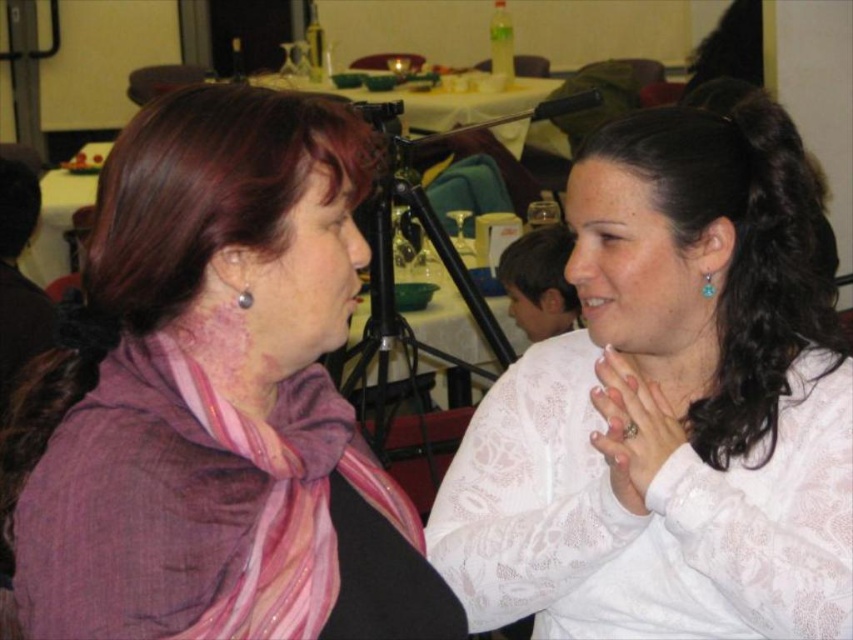
Does white lace blouse at center have a larger size compared to teal earrings at right?

Correct, white lace blouse at center is larger in size than teal earrings at right.

Which is above, white lace blouse at center or teal earrings at right?

teal earrings at right is above.

Image resolution: width=853 pixels, height=640 pixels. What do you see at coordinates (668, 406) in the screenshot? I see `white lace blouse at center` at bounding box center [668, 406].

The image size is (853, 640). What are the coordinates of `white lace blouse at center` in the screenshot? It's located at (668, 406).

Which is more to the left, purple scarf at left or teal earrings at right?

From the viewer's perspective, purple scarf at left appears more on the left side.

Is point (335, 170) more distant than point (637, 260)?

No, it is not.

Who is more forward, (67,534) or (639,310)?

Point (67,534)

Locate an element on the screen. The width and height of the screenshot is (853, 640). purple scarf at left is located at coordinates (213, 400).

Does teal earrings at right appear over silver metallic earring at upper left?

Yes.

Does point (677, 340) come behind point (242, 300)?

That is True.

You are a GUI agent. You are given a task and a screenshot of the screen. Output one action in this format:
    pyautogui.click(x=<x>, y=<y>)
    Task: Click on the teal earrings at right
    
    Given the screenshot: What is the action you would take?
    pyautogui.click(x=631, y=266)